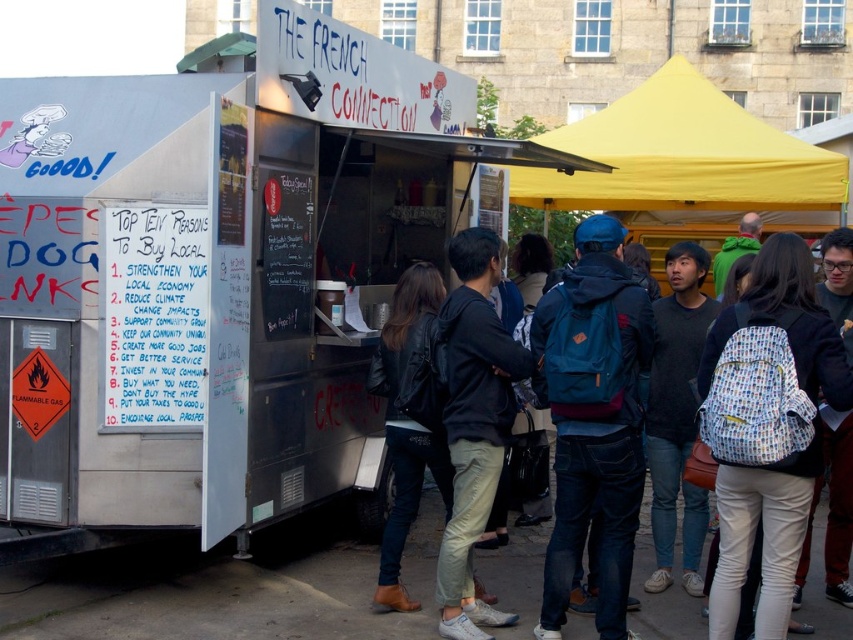
Consider the image. You are a customer waiting in line at The French Connection food truck. You notice a yellow fabric canopy at upper right and light beige pants at center. Which object is positioned to the right of the other?

The yellow fabric canopy at upper right is to the right of light beige pants at center according to the description.

Looking at this image, you are a customer standing in front of the food truck and see both the metallic silver food truck at center and the blue backpack at center. Which object is positioned to the left from your perspective?

The metallic silver food truck at center is to the left of the blue backpack at center from the customer perspective.

You are standing in front of The French Connection food truck and notice two points marked on its exterior. The first point is at coordinate point (337, 396) and the second is at point (611, 458). Which point appears closer to you?

Point (337, 396) is further to the camera than point (611, 458), so the second point is closer to you.